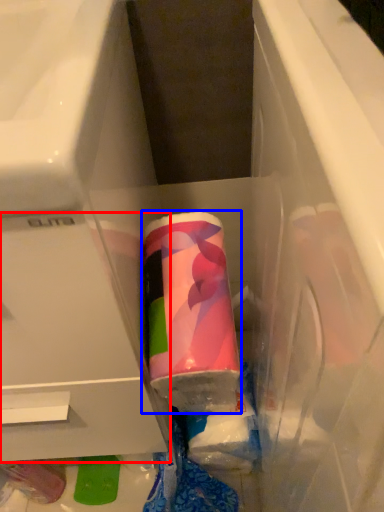
Question: Among these objects, which one is nearest to the camera, drawer (highlighted by a red box) or toothpaste (highlighted by a blue box)?

Choices:
 (A) drawer
 (B) toothpaste

Answer: (A)